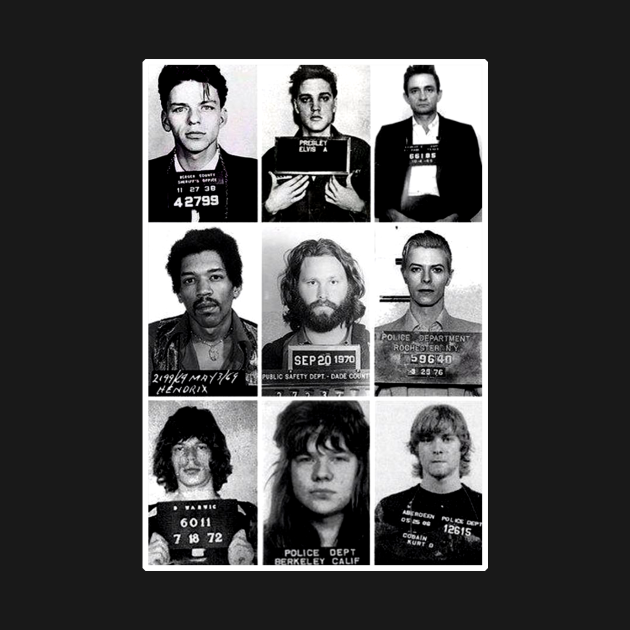
Where is `art`? The width and height of the screenshot is (630, 630). art is located at coordinates (573, 530).